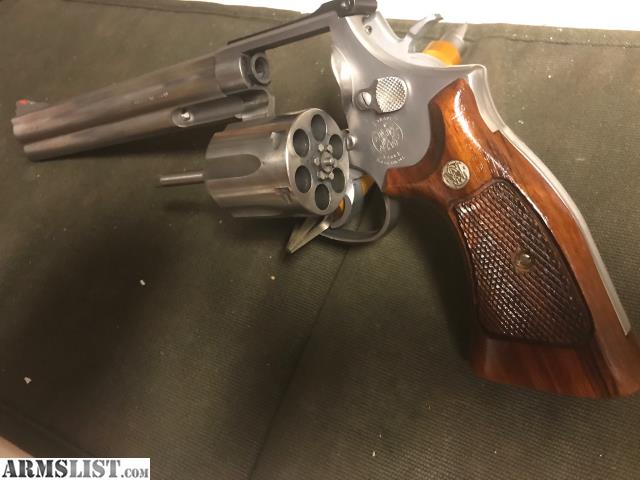
Locate an element on the screen. handle is located at coordinates (546, 288).